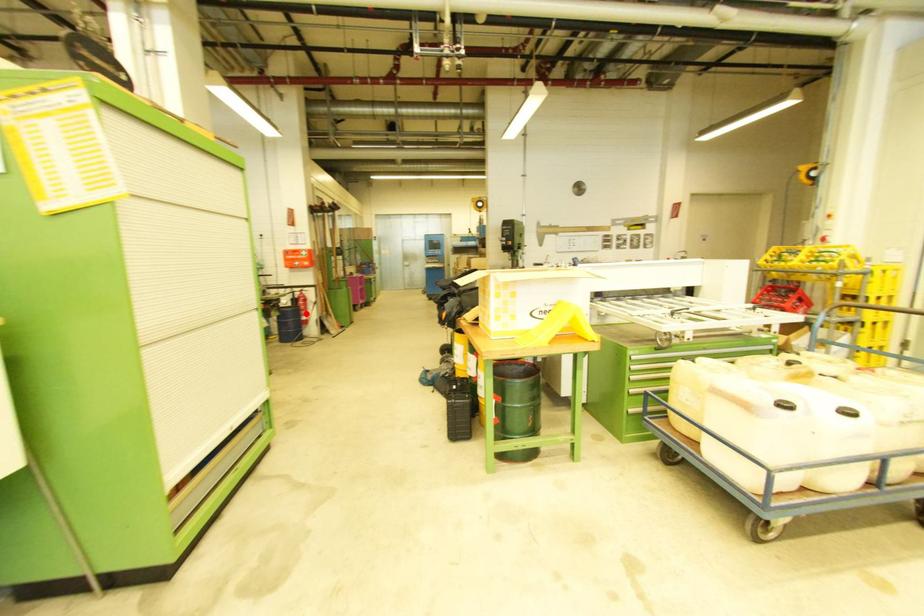
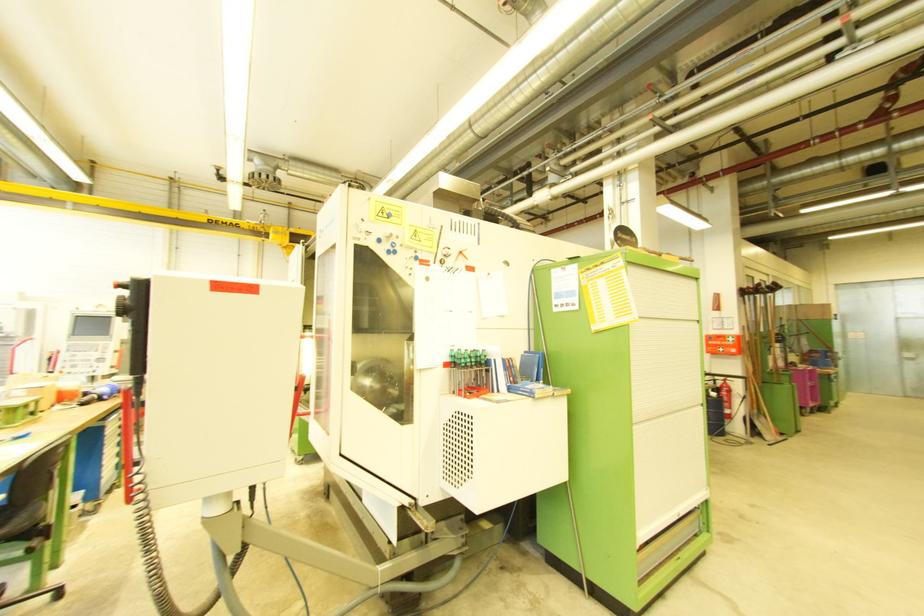
In the second image, find the point that corresponds to the highlighted location in the first image.

(727, 407)